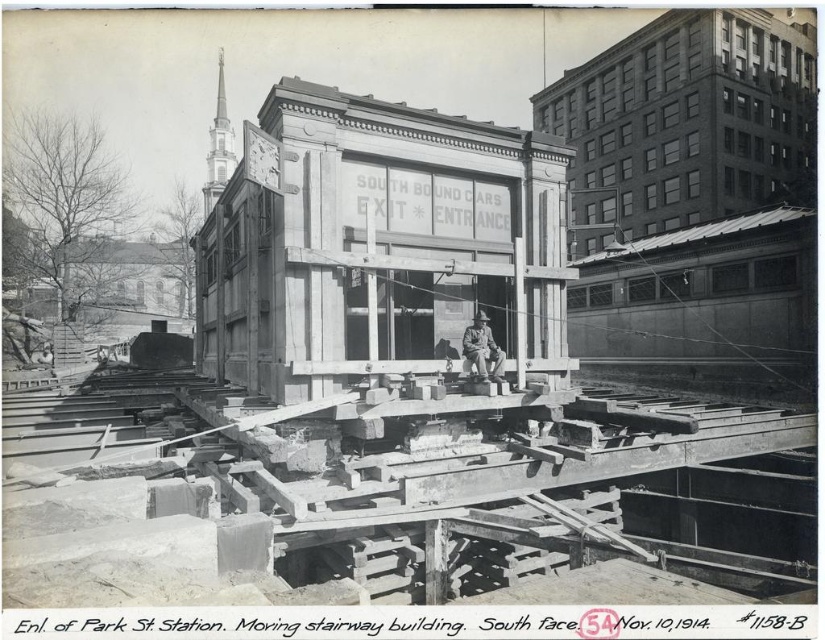
In the image of the construction site at Park Street Station, there is a point labeled at coordinates (370, 483). What object is located at this point?

The point at coordinates (370, 483) marks the location of wooden beams at center.

Looking at this image, you are a construction worker tasked with moving materials around the site. You have a wooden crate that is 1 meter wide. Can you place the crate between the wooden beams at center and the camouflage fabric uniform at center without it touching either?

The wooden beams at center are wider than the camouflage fabric uniform at center. However, since the exact distance between them isn

You are an observer at the construction site. You see the wooden beams at center and the camouflage fabric uniform at center. Which object is positioned to the right?

The camouflage fabric uniform at center is positioned to the right of the wooden beams at center.